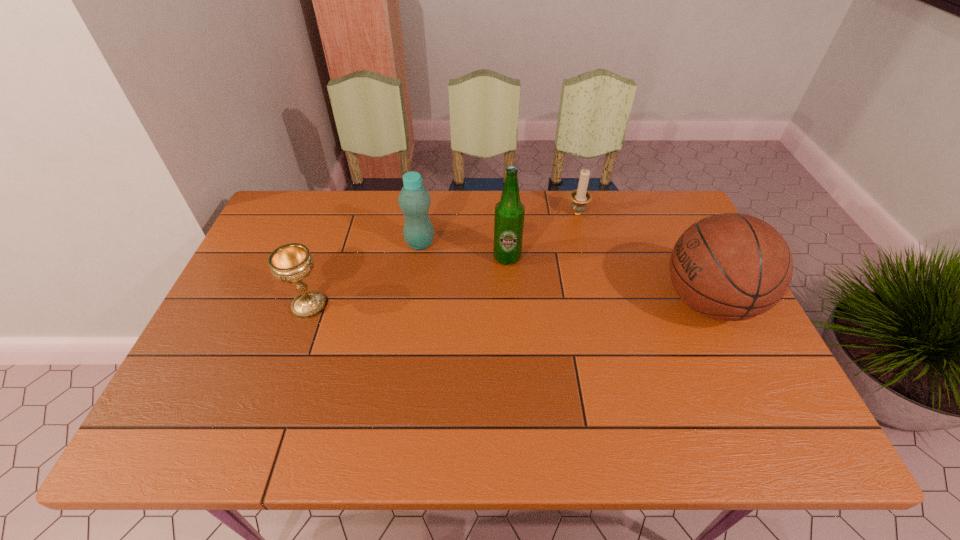
The height and width of the screenshot is (540, 960). I want to click on free spot located on the handle side of the candle_holder, so click(560, 243).

At what (x,y) coordinates should I click in order to perform the action: click on vacant space situated 0.300m on the handle side of the candle_holder. Please return your answer as a coordinate pair (x, y). The width and height of the screenshot is (960, 540). Looking at the image, I should click on (536, 280).

At what (x,y) coordinates should I click in order to perform the action: click on vacant position located 0.220m on the handle side of the candle_holder. Please return your answer as a coordinate pair (x, y). The height and width of the screenshot is (540, 960). Looking at the image, I should click on (547, 263).

Identify the location of vacant area located 0.060m at the front cap of the water bottle. The width and height of the screenshot is (960, 540). (442, 261).

At what (x,y) coordinates should I click in order to perform the action: click on free space located at the front cap of the water bottle. Please return your answer as a coordinate pair (x, y). This screenshot has height=540, width=960. Looking at the image, I should click on (452, 271).

You are a GUI agent. You are given a task and a screenshot of the screen. Output one action in this format:
    pyautogui.click(x=<x>, y=<y>)
    Task: Click on the free space located 0.300m at the front cap of the water bottle
    
    Given the screenshot: What is the action you would take?
    pyautogui.click(x=497, y=308)

You are a GUI agent. You are given a task and a screenshot of the screen. Output one action in this format:
    pyautogui.click(x=<x>, y=<y>)
    Task: Click on the vacant area situated on the label of the beer bottle
    The image size is (960, 540).
    Given the screenshot: What is the action you would take?
    pyautogui.click(x=542, y=294)

Where is `blank space located 0.260m on the label of the beer bottle`? This screenshot has width=960, height=540. blank space located 0.260m on the label of the beer bottle is located at coordinates (574, 326).

This screenshot has width=960, height=540. I want to click on free space located on the label of the beer bottle, so click(595, 348).

You are a GUI agent. You are given a task and a screenshot of the screen. Output one action in this format:
    pyautogui.click(x=<x>, y=<y>)
    Task: Click on the candle_holder present at the far edge
    
    Given the screenshot: What is the action you would take?
    pyautogui.click(x=580, y=197)